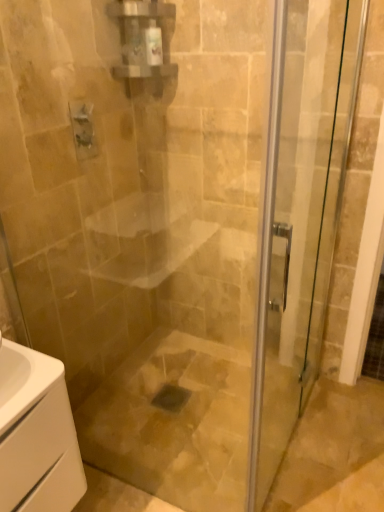
Question: Looking at their shapes, would you say white glossy cabinet at lower left is wider or thinner than transparent glass door at center?

Choices:
 (A) thin
 (B) wide

Answer: (B)

Question: Is white glossy cabinet at lower left spatially inside transparent glass door at center, or outside of it?

Choices:
 (A) inside
 (B) outside

Answer: (B)

Question: Which is farther from the transparent glass door at center?

Choices:
 (A) matte silver faucet at upper left
 (B) white glossy cabinet at lower left

Answer: (A)

Question: Which of these objects is positioned closest to the white glossy cabinet at lower left?

Choices:
 (A) transparent glass door at center
 (B) matte silver faucet at upper left

Answer: (A)